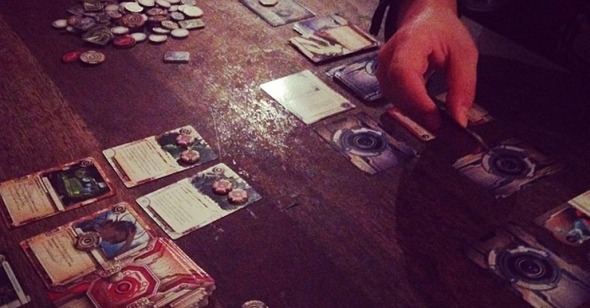
Locate an element on the screen. Image resolution: width=590 pixels, height=308 pixels. table is located at coordinates click(x=211, y=84).